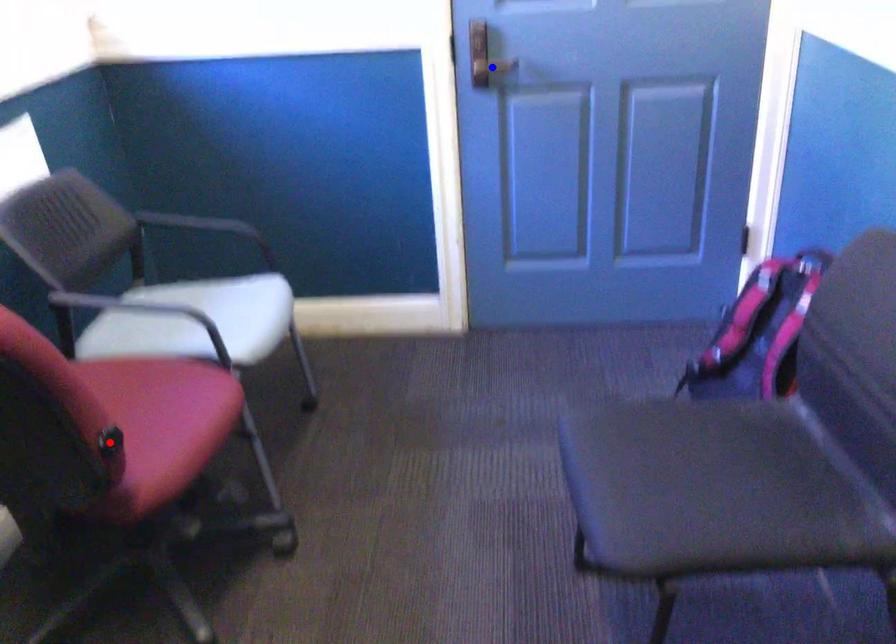
Question: In the image, two points are highlighted. Which point is nearer to the camera? Reply with the corresponding letter.

Choices:
 (A) blue point
 (B) red point

Answer: (B)